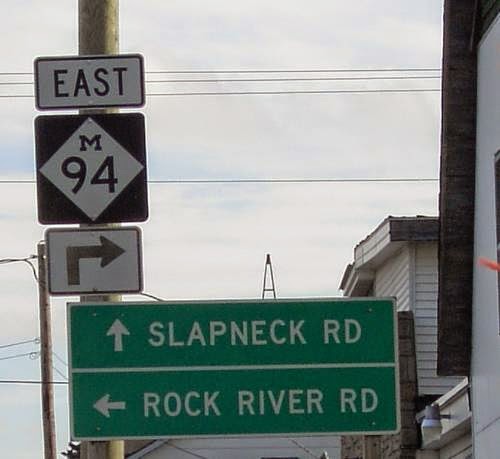
Identify the location of light. (433, 430).